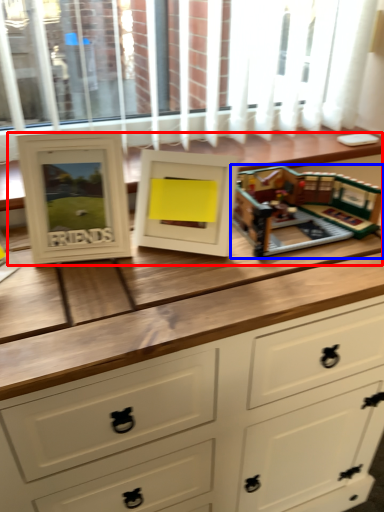
Question: Among these objects, which one is nearest to the camera, buffet (highlighted by a red box) or toy (highlighted by a blue box)?

Choices:
 (A) buffet
 (B) toy

Answer: (B)